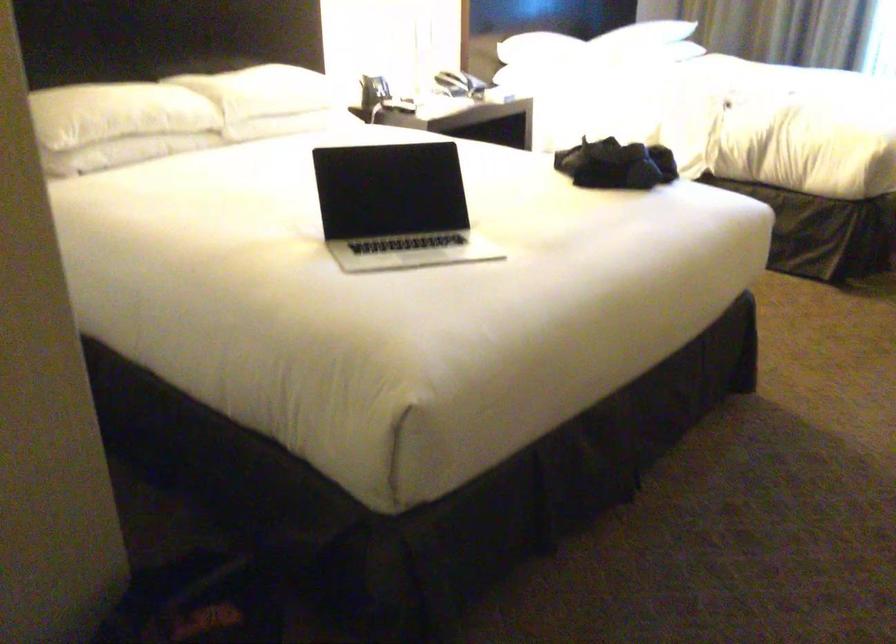
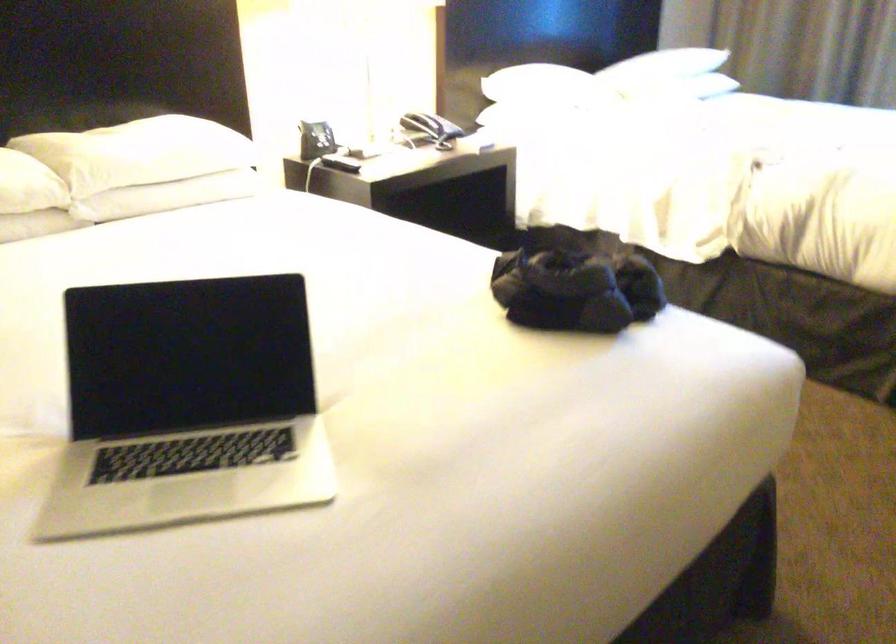
Locate, in the second image, the point that corresponds to pixel 754 128 in the first image.

(784, 212)